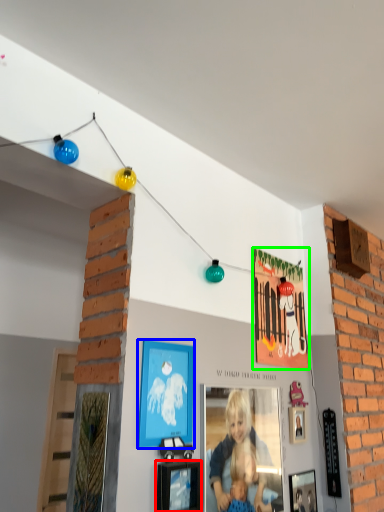
Question: Which object is positioned closest to picture frame (highlighted by a red box)? Select from picture frame (highlighted by a blue box) and picture frame (highlighted by a green box).

Choices:
 (A) picture frame
 (B) picture frame

Answer: (A)